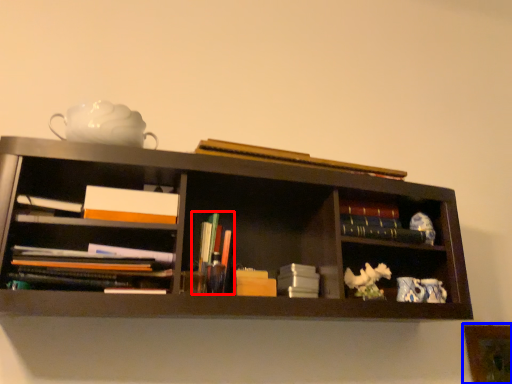
Question: Which object is closer to the camera taking this photo, book (highlighted by a red box) or picture frame (highlighted by a blue box)?

Choices:
 (A) book
 (B) picture frame

Answer: (A)